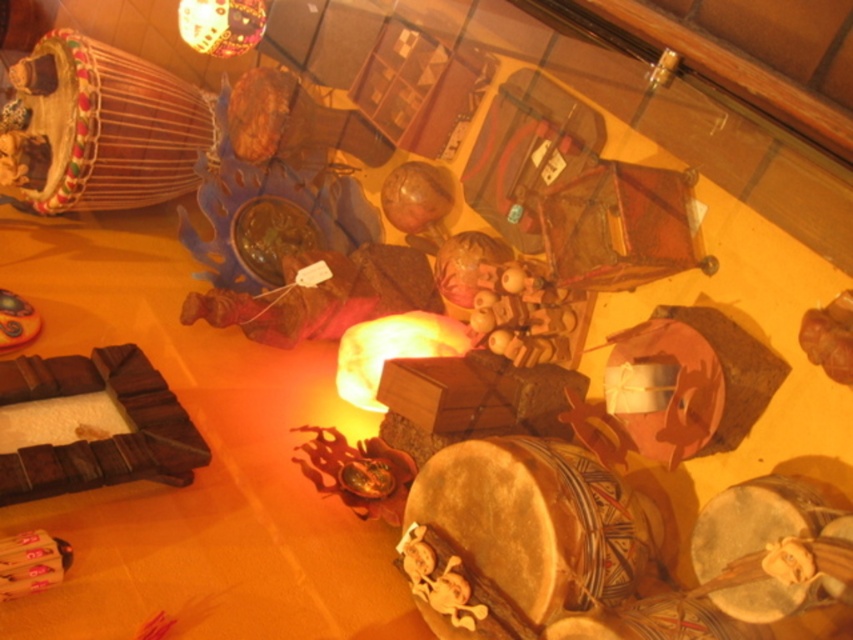
Based on the photo, you are a customer in a shop and want to pick up both the multicolored wooden drum at upper left and the wooden drum at lower right. Which drum will you reach first if you approach from the front of the display?

The multicolored wooden drum at upper left will be reached first because it is closer to the viewer than the wooden drum at lower right.

You are a delivery person who needs to place a new package between the natural wood drum at center and the wooden drum at lower right. The package is 7 inches wide. Can you fit it between them without moving either drum?

The distance between the natural wood drum at center and the wooden drum at lower right is 8.08 inches, so yes, the 7 inch wide package can fit between them as there is enough space.

You are a customer in a shop and want to place both the leather drum at center and the wooden drum at lower right on your shelf. The shelf has limited vertical space. Which drum should you choose to fit better in terms of height?

The wooden drum at lower right is shorter than the leather drum at center, so it would fit better in terms of height on the shelf with limited vertical space.